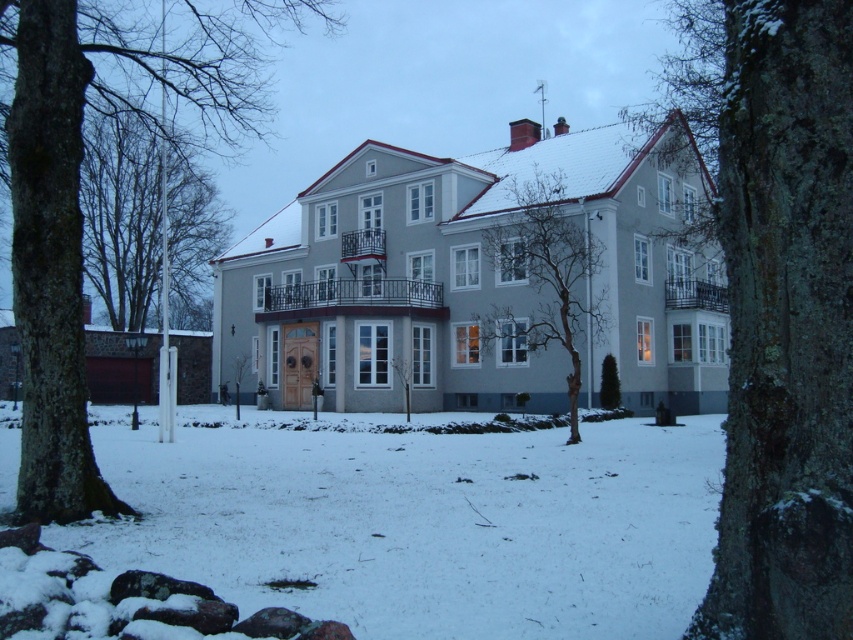
Question: Which point is farther to the camera?

Choices:
 (A) bare branches at center
 (B) bare branches at left
 (C) green mossy bark tree at center
 (D) white powdery snow at center

Answer: (B)

Question: Does white powdery snow at center appear on the left side of brown bark tree at left?

Choices:
 (A) no
 (B) yes

Answer: (A)

Question: Which point is closer to the camera taking this photo?

Choices:
 (A) (738, 22)
 (B) (538, 211)
 (C) (263, 513)
 (D) (200, 60)

Answer: (A)

Question: Does white powdery snow at center have a greater width compared to bare branches at left?

Choices:
 (A) no
 (B) yes

Answer: (A)

Question: Is green mossy bark tree at center below bare branches at center?

Choices:
 (A) no
 (B) yes

Answer: (A)

Question: Which object is the closest to the bare branches at center?

Choices:
 (A) green mossy bark tree at center
 (B) brown bark tree at left

Answer: (A)